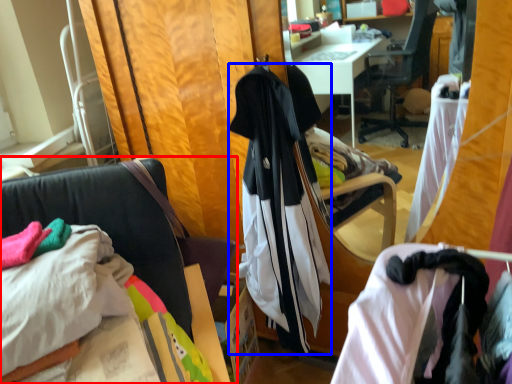
Question: Which of the following is the closest to the observer, chair (highlighted by a red box) or garment (highlighted by a blue box)?

Choices:
 (A) chair
 (B) garment

Answer: (A)